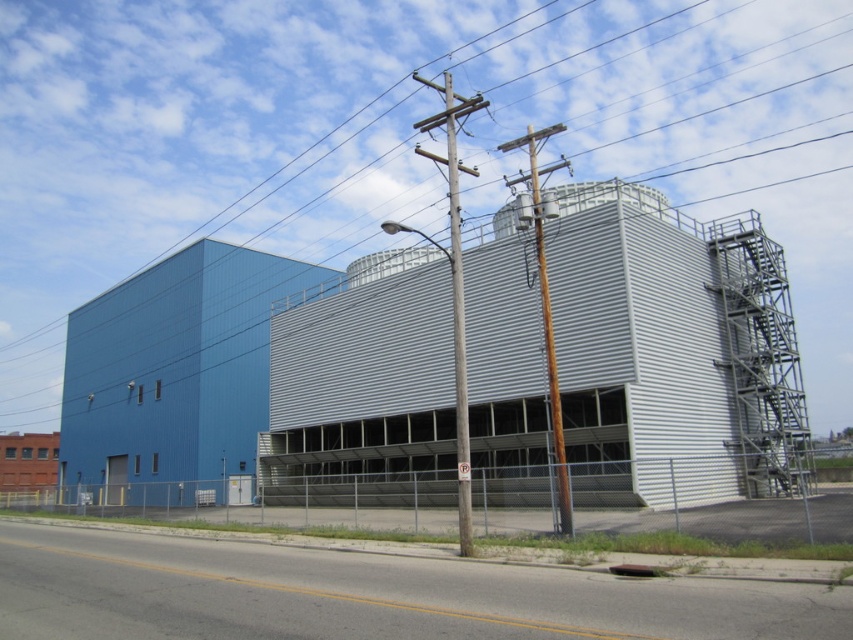
Describe the element at coordinates (202, 141) in the screenshot. Image resolution: width=853 pixels, height=640 pixels. I see `metallic wire at upper center` at that location.

Is metallic wire at upper center below wooden utility pole at center?

Actually, metallic wire at upper center is above wooden utility pole at center.

Locate an element on the screen. The image size is (853, 640). metallic wire at upper center is located at coordinates (202, 141).